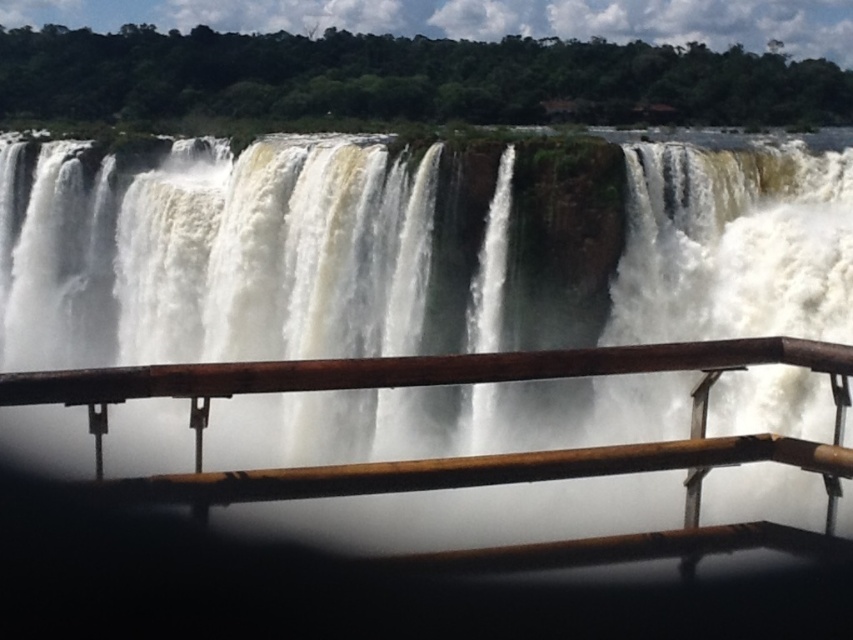
Is white frothy water at center positioned in front of brown wooden rail at center?

That is False.

This screenshot has height=640, width=853. What do you see at coordinates (256, 257) in the screenshot?
I see `white frothy water at center` at bounding box center [256, 257].

At what (x,y) coordinates should I click in order to perform the action: click on white frothy water at center. Please return your answer as a coordinate pair (x, y). Looking at the image, I should click on (256, 257).